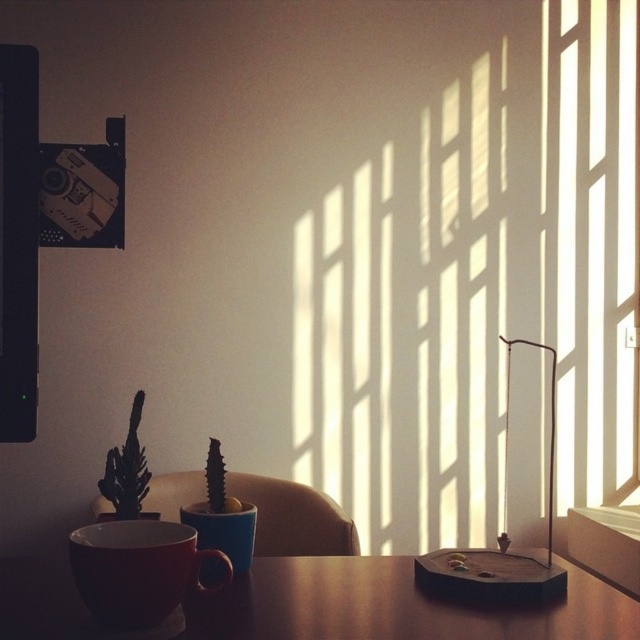
Question: Does brown wooden table at center have a lesser width compared to matte ceramic cup at center?

Choices:
 (A) yes
 (B) no

Answer: (B)

Question: Is translucent glass window at center to the right of brown wooden table at center from the viewer's perspective?

Choices:
 (A) no
 (B) yes

Answer: (B)

Question: Which point appears farthest from the camera in this image?

Choices:
 (A) (577, 611)
 (B) (536, 572)
 (C) (193, 595)
 (D) (468, 486)

Answer: (D)

Question: Which of the following is the closest to the observer?

Choices:
 (A) (435, 588)
 (B) (458, 298)
 (C) (292, 554)

Answer: (A)

Question: Is matte ceramic mug at lower center thinner than wooden base at right?

Choices:
 (A) no
 (B) yes

Answer: (B)

Question: Which of the following is the closest to the observer?

Choices:
 (A) (163, 561)
 (B) (536, 564)

Answer: (A)